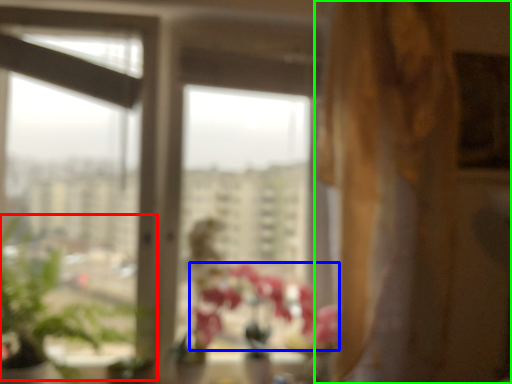
Question: Considering the real-world distances, which object is closest to plant (highlighted by a red box)? flower (highlighted by a blue box) or curtain (highlighted by a green box).

Choices:
 (A) flower
 (B) curtain

Answer: (A)